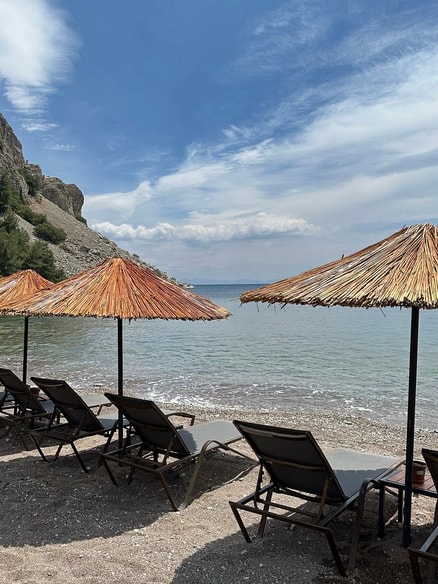
The width and height of the screenshot is (438, 584). In order to click on chair legs in this screenshot , I will do `click(182, 507)`, `click(119, 482)`, `click(85, 469)`, `click(48, 458)`, `click(25, 444)`, `click(260, 530)`, `click(341, 562)`.